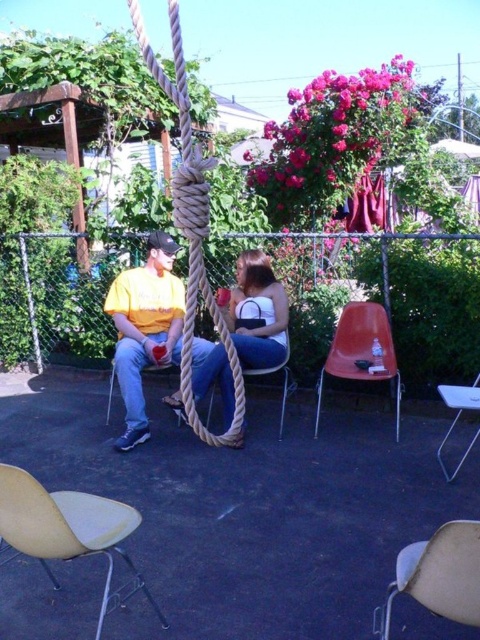
Question: Which object is farther from the camera taking this photo?

Choices:
 (A) white plastic chair at lower right
 (B) white plastic chair at center
 (C) orange plastic chair at center

Answer: (B)

Question: Which object appears closest to the camera in this image?

Choices:
 (A) white plastic chair at center
 (B) yellow matte shirt at center
 (C) matte white purse at center

Answer: (C)

Question: Considering the relative positions of light beige plastic chair at lower left and orange plastic chair at center in the image provided, where is light beige plastic chair at lower left located with respect to orange plastic chair at center?

Choices:
 (A) above
 (B) below

Answer: (B)

Question: Is light beige plastic chair at lower left positioned in front of white plastic chair at lower right?

Choices:
 (A) yes
 (B) no

Answer: (A)

Question: In this image, where is yellow matte shirt at center located relative to orange plastic chair at center?

Choices:
 (A) below
 (B) above

Answer: (B)

Question: Estimate the real-world distances between objects in this image. Which object is closer to the matte white purse at center?

Choices:
 (A) yellow matte shirt at center
 (B) light beige plastic chair at lower left
 (C) orange plastic chair at center

Answer: (A)